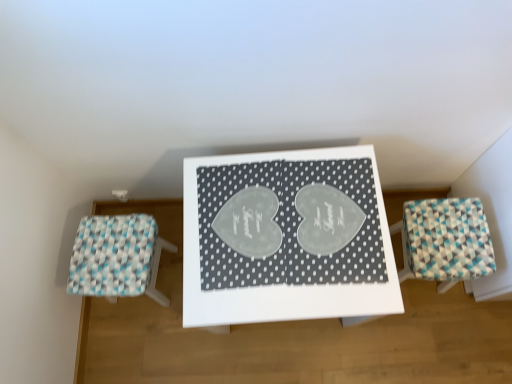
Question: Should I look upward or downward to see white woven stool at left, the 2th furniture positioned from the right?

Choices:
 (A) up
 (B) down

Answer: (B)

Question: From the image's perspective, would you say white woven stool at left, the 1th furniture viewed from the left, is positioned over white glossy table at center?

Choices:
 (A) no
 (B) yes

Answer: (A)

Question: Does white woven stool at left, the 1th furniture viewed from the left, have a lesser width compared to white glossy table at center?

Choices:
 (A) no
 (B) yes

Answer: (B)

Question: Is white woven stool at left, the 2th furniture positioned from the right, behind white glossy table at center?

Choices:
 (A) no
 (B) yes

Answer: (B)

Question: Are white woven stool at left, the 1th furniture viewed from the left, and white glossy table at center far apart?

Choices:
 (A) no
 (B) yes

Answer: (A)

Question: From a real-world perspective, is white woven stool at left, the 1th furniture viewed from the left, positioned under white glossy table at center based on gravity?

Choices:
 (A) yes
 (B) no

Answer: (A)

Question: Is white woven stool at left, the 2th furniture positioned from the right, to the left of white glossy table at center from the viewer's perspective?

Choices:
 (A) yes
 (B) no

Answer: (A)

Question: Considering the relative sizes of white glossy table at center and white woven stool at left, the 1th furniture viewed from the left, in the image provided, is white glossy table at center smaller than white woven stool at left, the 1th furniture viewed from the left,?

Choices:
 (A) no
 (B) yes

Answer: (A)

Question: From a real-world perspective, is white glossy table at center positioned under white woven stool at left, the 2th furniture positioned from the right, based on gravity?

Choices:
 (A) yes
 (B) no

Answer: (B)

Question: From the image's perspective, is white glossy table at center over white woven stool at left, the 2th furniture positioned from the right?

Choices:
 (A) no
 (B) yes

Answer: (B)

Question: Does white glossy table at center have a greater width compared to white woven stool at left, the 1th furniture viewed from the left?

Choices:
 (A) no
 (B) yes

Answer: (B)

Question: Are white glossy table at center and white woven stool at left, the 2th furniture positioned from the right, beside each other?

Choices:
 (A) yes
 (B) no

Answer: (B)

Question: Could you tell me if white glossy table at center is turned towards white woven stool at left, the 1th furniture viewed from the left?

Choices:
 (A) yes
 (B) no

Answer: (B)

Question: Is teal-patterned stool at right, placed as the 2th furniture when sorted from left to right, not near white woven stool at left, the 2th furniture positioned from the right?

Choices:
 (A) yes
 (B) no

Answer: (A)